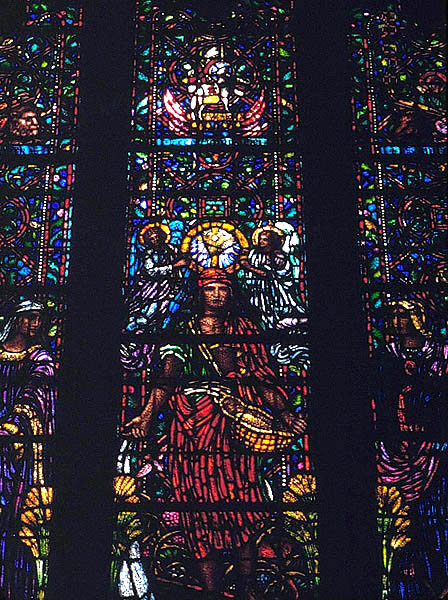
I want to click on colored window, so click(x=211, y=262), click(x=33, y=270), click(x=376, y=287).